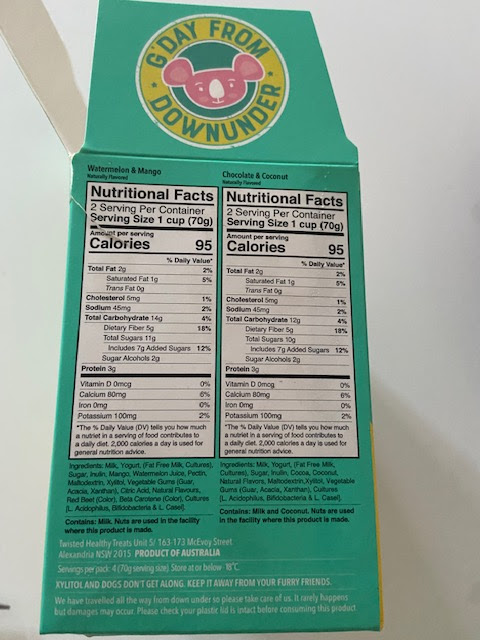
This screenshot has height=640, width=480. Identify the location of white background/wall. (404, 100).